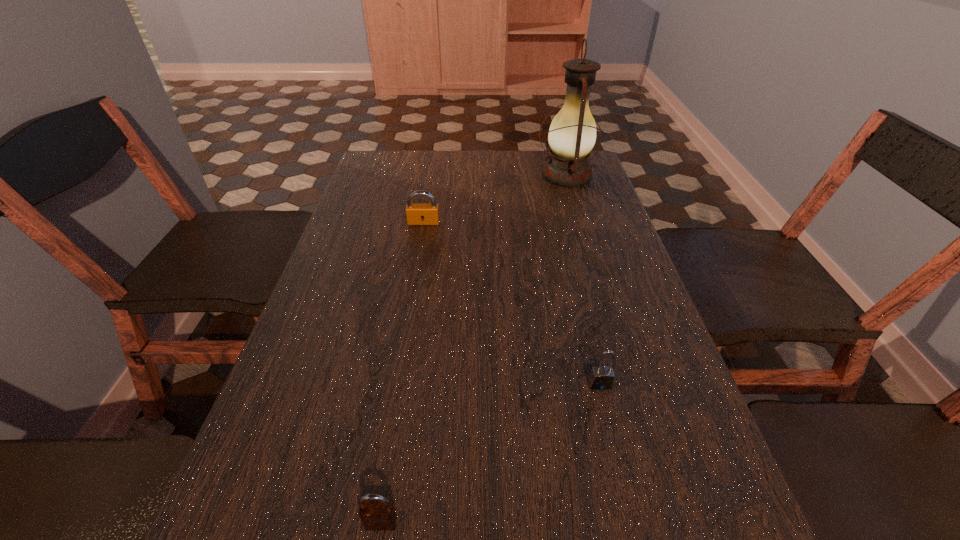
This screenshot has width=960, height=540. I want to click on the third closest padlock to the oil lamp, so click(380, 515).